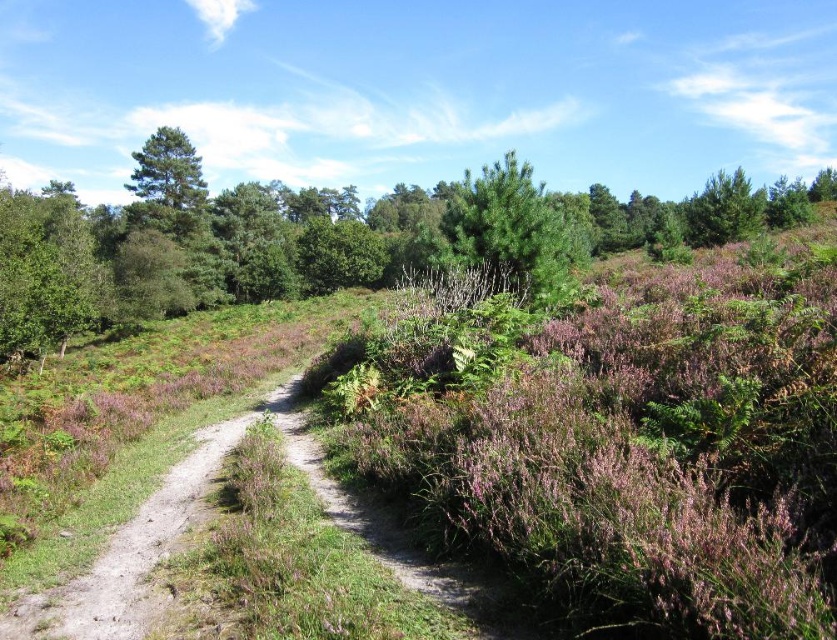
Which is in front, point (98, 275) or point (483, 168)?

Point (483, 168) is in front.

Between green leafy tree at left and green matte tree at center, which one is positioned higher?

green matte tree at center is above.

In order to click on green leafy tree at left in this screenshot , I will do `click(44, 273)`.

This screenshot has width=837, height=640. I want to click on green leafy tree at left, so click(44, 273).